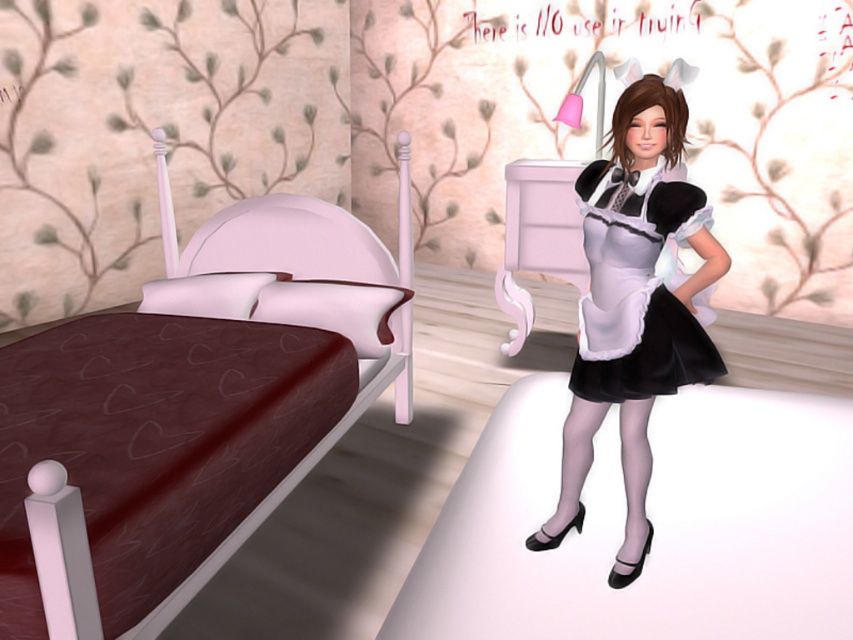
Does brown fabric bed at center lie in front of black satin dress at center?

Yes, it is in front of black satin dress at center.

Does brown fabric bed at center appear on the right side of black satin dress at center?

Incorrect, brown fabric bed at center is not on the right side of black satin dress at center.

Locate an element on the screen. This screenshot has width=853, height=640. brown fabric bed at center is located at coordinates (190, 410).

Where is `brown fabric bed at center`? brown fabric bed at center is located at coordinates (190, 410).

Does brown fabric bed at center have a lesser height compared to matte black maid outfit at center?

In fact, brown fabric bed at center may be taller than matte black maid outfit at center.

Can you confirm if brown fabric bed at center is positioned to the right of matte black maid outfit at center?

In fact, brown fabric bed at center is to the left of matte black maid outfit at center.

Is point (241, 262) closer to viewer compared to point (651, 97)?

That is False.

Identify the location of brown fabric bed at center. (190, 410).

Who is higher up, matte black maid outfit at center or black satin dress at center?

Positioned higher is black satin dress at center.

Does matte black maid outfit at center appear on the right side of black satin dress at center?

Indeed, matte black maid outfit at center is positioned on the right side of black satin dress at center.

Is point (541, 534) positioned behind point (589, 244)?

Yes, point (541, 534) is behind point (589, 244).

Image resolution: width=853 pixels, height=640 pixels. Find the location of `matte black maid outfit at center`. matte black maid outfit at center is located at coordinates (634, 307).